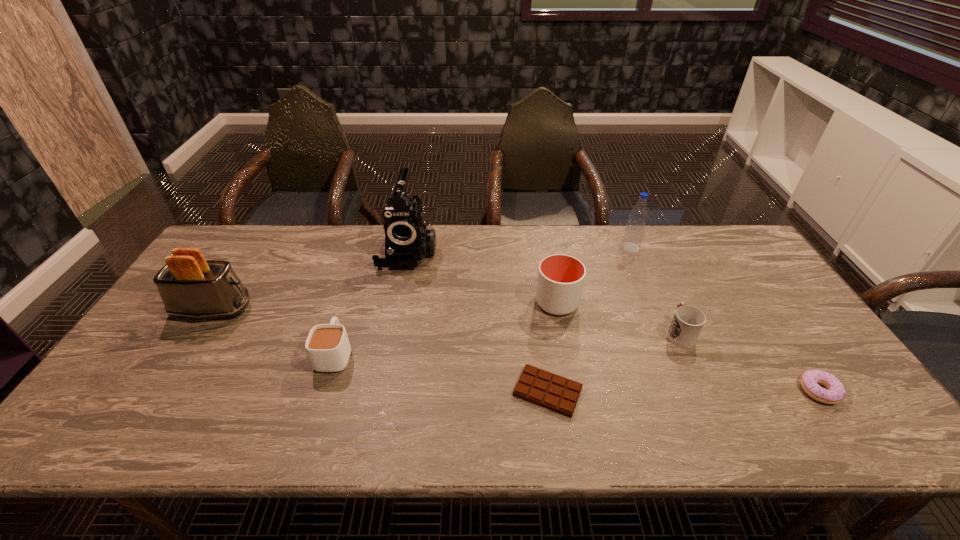
Locate an element on the screen. The width and height of the screenshot is (960, 540). free point located 0.050m on the back of the doughnut is located at coordinates (798, 360).

Find the location of a particular element. The width and height of the screenshot is (960, 540). vacant space located 0.180m on the back of the candy bar is located at coordinates (538, 316).

What are the coordinates of `camcorder present at the far edge` in the screenshot? It's located at (407, 242).

You are a GUI agent. You are given a task and a screenshot of the screen. Output one action in this format:
    pyautogui.click(x=<x>, y=<y>)
    Task: Click on the water bottle that is at the far edge
    The height and width of the screenshot is (540, 960).
    Given the screenshot: What is the action you would take?
    (x=634, y=231)

You are a GUI agent. You are given a task and a screenshot of the screen. Output one action in this format:
    pyautogui.click(x=<x>, y=<y>)
    Task: Click on the object that is positioned at the near edge
    This screenshot has width=960, height=540.
    Given the screenshot: What is the action you would take?
    pyautogui.click(x=556, y=393)

Locate an element on the screen. The height and width of the screenshot is (540, 960). object that is at the left edge is located at coordinates (190, 286).

Identify the location of object at the right edge. (835, 392).

Find the location of a particular element. Image resolution: width=960 pixels, height=540 pixels. vacant space at the far edge is located at coordinates (668, 234).

Locate an element on the screen. The width and height of the screenshot is (960, 540). vacant space at the near edge of the desktop is located at coordinates (770, 410).

Locate an element on the screen. vacant space at the left edge of the desktop is located at coordinates (165, 321).